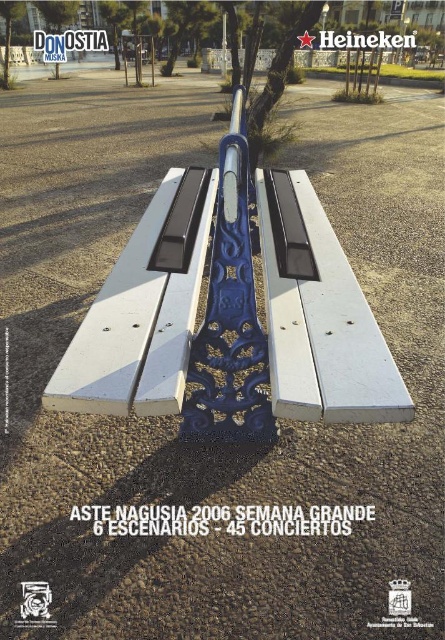
Question: Is white painted wood bench at center smaller than blue metallic pole at center?

Choices:
 (A) no
 (B) yes

Answer: (A)

Question: Can you confirm if white painted wood bench at center is positioned to the left of blue metallic pole at center?

Choices:
 (A) no
 (B) yes

Answer: (A)

Question: Which of the following is the closest to the observer?

Choices:
 (A) blue metallic pole at center
 (B) white painted wood bench at center

Answer: (B)

Question: Is white painted wood bench at center smaller than blue metallic pole at center?

Choices:
 (A) yes
 (B) no

Answer: (B)